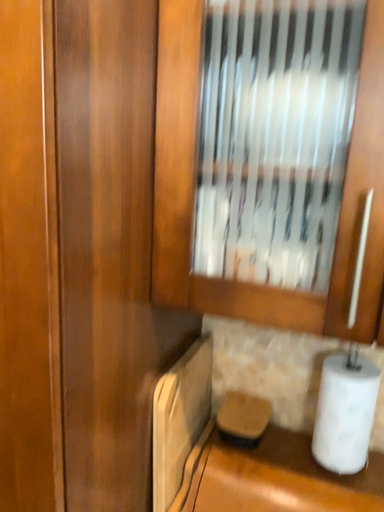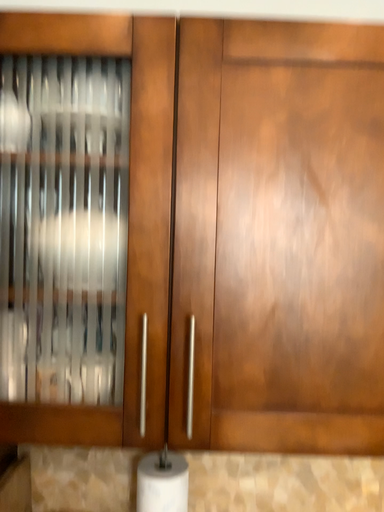
Question: How did the camera likely rotate when shooting the video?

Choices:
 (A) rotated upward
 (B) rotated downward

Answer: (A)